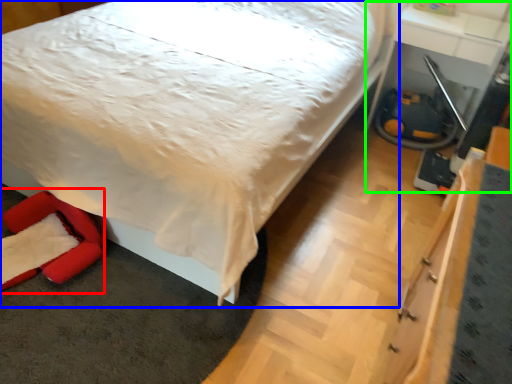
Question: Considering the real-world distances, which object is farthest from swivel chair (highlighted by a red box)? bed (highlighted by a blue box) or table (highlighted by a green box)?

Choices:
 (A) bed
 (B) table

Answer: (B)